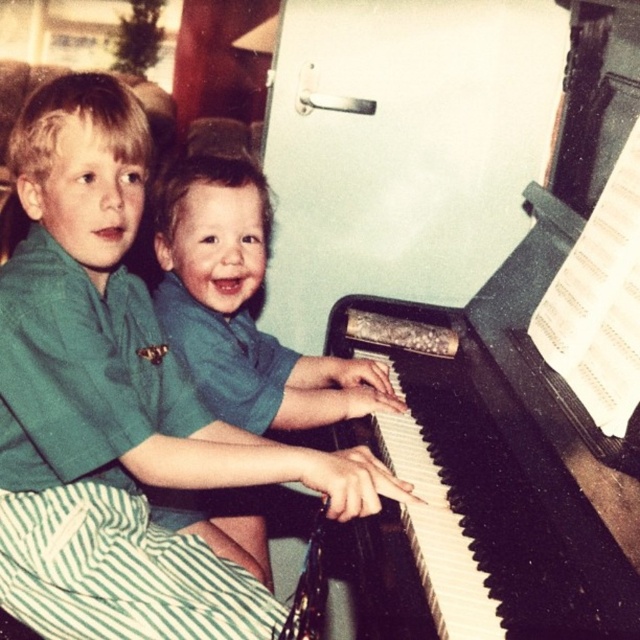
Question: Is green cotton shirt at upper left positioned at the back of black polished piano at center?

Choices:
 (A) yes
 (B) no

Answer: (A)

Question: Is green cotton shirt at upper left to the right of green matte shirt at center from the viewer's perspective?

Choices:
 (A) yes
 (B) no

Answer: (B)

Question: Among these objects, which one is nearest to the camera?

Choices:
 (A) green matte shirt at center
 (B) black polished piano at center

Answer: (B)

Question: Can you confirm if black polished piano at center is thinner than green matte shirt at center?

Choices:
 (A) no
 (B) yes

Answer: (A)

Question: Which object is the closest to the green cotton shirt at upper left?

Choices:
 (A) black polished piano at center
 (B) green matte shirt at center

Answer: (B)

Question: Among these points, which one is nearest to the camera?

Choices:
 (A) (17, 486)
 (B) (484, 621)
 (C) (176, 172)

Answer: (B)